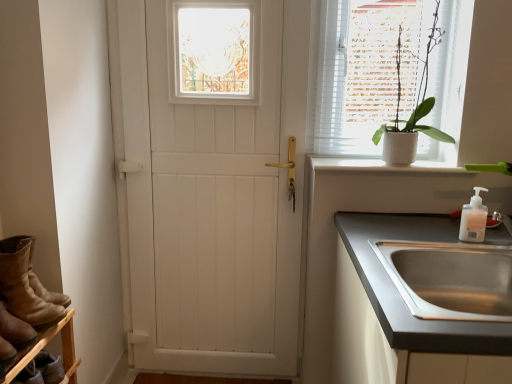
Image resolution: width=512 pixels, height=384 pixels. What are the coordinates of `brown suede boots at lower left` in the screenshot? It's located at (27, 286).

What do you see at coordinates (27, 286) in the screenshot?
I see `brown suede boots at lower left` at bounding box center [27, 286].

The image size is (512, 384). What do you see at coordinates (420, 302) in the screenshot? I see `stainless steel sink at lower right` at bounding box center [420, 302].

What is the approximate width of brown wooden shelf at lower left?

The width of brown wooden shelf at lower left is 20.41 centimeters.

What do you see at coordinates (413, 109) in the screenshot? The height and width of the screenshot is (384, 512). I see `white matte pot at upper right` at bounding box center [413, 109].

The width and height of the screenshot is (512, 384). What are the coordinates of `brown suede boot at lower left` in the screenshot? It's located at (15, 329).

This screenshot has width=512, height=384. What do you see at coordinates (213, 193) in the screenshot? I see `white matte door at center` at bounding box center [213, 193].

Describe the element at coordinates (386, 167) in the screenshot. The image size is (512, 384). I see `white smooth window sill at upper right` at that location.

Locate an element on the screen. The width and height of the screenshot is (512, 384). brown suede boots at lower left is located at coordinates (27, 286).

In terms of width, does white smooth window sill at upper right look wider or thinner when compared to brown suede boot at lower left?

In the image, white smooth window sill at upper right appears to be wider than brown suede boot at lower left.

How many degrees apart are the facing directions of white smooth window sill at upper right and brown suede boot at lower left?

The angular difference between white smooth window sill at upper right and brown suede boot at lower left is 70.9 degrees.

Who is taller, white smooth window sill at upper right or brown suede boot at lower left?

brown suede boot at lower left.

Is white plastic soap dispenser at upper right bigger or smaller than brown suede boots at lower left?

Clearly, white plastic soap dispenser at upper right is smaller in size than brown suede boots at lower left.

From the picture: Is white plastic soap dispenser at upper right facing towards brown suede boots at lower left?

No, white plastic soap dispenser at upper right is not turned towards brown suede boots at lower left.

Would you consider white matte door at center to be distant from white smooth window sill at upper right?

No.

Can you confirm if white matte door at center is wider than white smooth window sill at upper right?

Incorrect, the width of white matte door at center does not surpass that of white smooth window sill at upper right.

Is white matte door at center positioned with its back to white smooth window sill at upper right?

No, white matte door at center's orientation is not away from white smooth window sill at upper right.

From the image's perspective, who appears lower, white matte door at center or white smooth window sill at upper right?

white matte door at center is shown below in the image.

Based on the photo, is brown suede boots at lower left positioned in front of stainless steel sink at lower right?

No, brown suede boots at lower left is further to the viewer.

Does point (5, 266) come behind point (415, 261)?

No, (5, 266) is closer to viewer.

Is brown suede boots at lower left inside the boundaries of stainless steel sink at lower right, or outside?

brown suede boots at lower left is spatially situated outside stainless steel sink at lower right.

Where is `footwear that appears above the stainless steel sink at lower right (from the image's perspective)`? The height and width of the screenshot is (384, 512). footwear that appears above the stainless steel sink at lower right (from the image's perspective) is located at coordinates (27, 286).

In terms of width, does white matte door at center look wider or thinner when compared to white matte pot at upper right?

white matte door at center is thinner than white matte pot at upper right.

Consider the image. Is white matte door at center closer to camera compared to white matte pot at upper right?

That is False.

Is white matte door at center positioned with its back to white matte pot at upper right?

No, white matte door at center is not facing the opposite direction of white matte pot at upper right.

Image resolution: width=512 pixels, height=384 pixels. I want to click on window sill lying on the left of white matte pot at upper right, so click(x=386, y=167).

Considering the relative sizes of white smooth window sill at upper right and white matte pot at upper right in the image provided, is white smooth window sill at upper right smaller than white matte pot at upper right?

Yes, white smooth window sill at upper right is smaller than white matte pot at upper right.

From a real-world perspective, is white smooth window sill at upper right on white matte pot at upper right?

No, from a real-world perspective, white smooth window sill at upper right is not above white matte pot at upper right.

Which object is more forward, brown wooden shelf at lower left or brown suede boot at lower left?

brown suede boot at lower left is closer to the camera.

Considering the positions of point (27, 352) and point (20, 347), is point (27, 352) closer or farther from the camera than point (20, 347)?

Point (27, 352).

Can you confirm if brown wooden shelf at lower left is shorter than brown suede boot at lower left?

Indeed, brown wooden shelf at lower left has a lesser height compared to brown suede boot at lower left.

The image size is (512, 384). Identify the location of window sill above the brown suede boot at lower left (from a real-world perspective). (386, 167).

In order to click on soap dispenser that is on the right side of brown suede boots at lower left in this screenshot , I will do `click(473, 219)`.

Looking at the image, which one is located further to white matte pot at upper right, brown suede boots at lower left or brown wooden shelf at lower left?

brown wooden shelf at lower left lies further to white matte pot at upper right than the other object.

Looking at the image, which one is located closer to white matte pot at upper right, white smooth window sill at upper right or brown suede boots at lower left?

The object closer to white matte pot at upper right is white smooth window sill at upper right.

When comparing their distances from brown wooden shelf at lower left, does brown suede boots at lower left or brown suede boot at lower left seem closer?

brown suede boot at lower left.

When comparing their distances from brown wooden shelf at lower left, does brown suede boots at lower left or stainless steel sink at lower right seem closer?

The object closer to brown wooden shelf at lower left is brown suede boots at lower left.

Considering their positions, is white smooth window sill at upper right positioned closer to stainless steel sink at lower right than brown suede boot at lower left?

Among the two, white smooth window sill at upper right is located nearer to stainless steel sink at lower right.

When comparing their distances from stainless steel sink at lower right, does white smooth window sill at upper right or brown suede boots at lower left seem closer?

white smooth window sill at upper right lies closer to stainless steel sink at lower right than the other object.

Considering their positions, is white plastic soap dispenser at upper right positioned closer to white smooth window sill at upper right than brown suede boots at lower left?

white plastic soap dispenser at upper right is closer to white smooth window sill at upper right.

Looking at the image, which one is located further to stainless steel sink at lower right, brown wooden shelf at lower left or white matte door at center?

brown wooden shelf at lower left lies further to stainless steel sink at lower right than the other object.

In order to click on door between brown wooden shelf at lower left and stainless steel sink at lower right from left to right in this screenshot , I will do `click(213, 193)`.

You are a GUI agent. You are given a task and a screenshot of the screen. Output one action in this format:
    pyautogui.click(x=<x>, y=<y>)
    Task: Click on the window sill between brown suede boots at lower left and white plastic soap dispenser at upper right
    The width and height of the screenshot is (512, 384).
    Given the screenshot: What is the action you would take?
    pyautogui.click(x=386, y=167)

What are the coordinates of `window sill between white matte door at center and white plastic soap dispenser at upper right` in the screenshot? It's located at (386, 167).

You are a GUI agent. You are given a task and a screenshot of the screen. Output one action in this format:
    pyautogui.click(x=<x>, y=<y>)
    Task: Click on the door between brown suede boots at lower left and stainless steel sink at lower right in the horizontal direction
    The width and height of the screenshot is (512, 384).
    Given the screenshot: What is the action you would take?
    pyautogui.click(x=213, y=193)